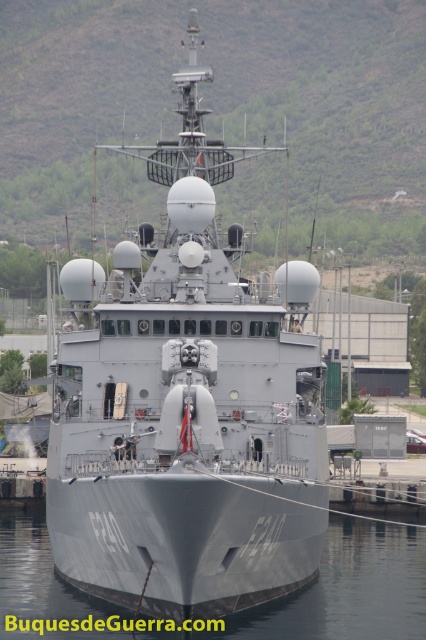
Question: From the image, what is the correct spatial relationship of gray metallic ship at center in relation to gray metallic water at center?

Choices:
 (A) left
 (B) right

Answer: (A)

Question: Which point is farther from the camera taking this photo?

Choices:
 (A) (74, 364)
 (B) (296, 600)

Answer: (A)

Question: Is gray metallic ship at center positioned at the back of gray metallic water at center?

Choices:
 (A) no
 (B) yes

Answer: (A)

Question: Is gray metallic ship at center further to the viewer compared to gray metallic water at center?

Choices:
 (A) yes
 (B) no

Answer: (B)